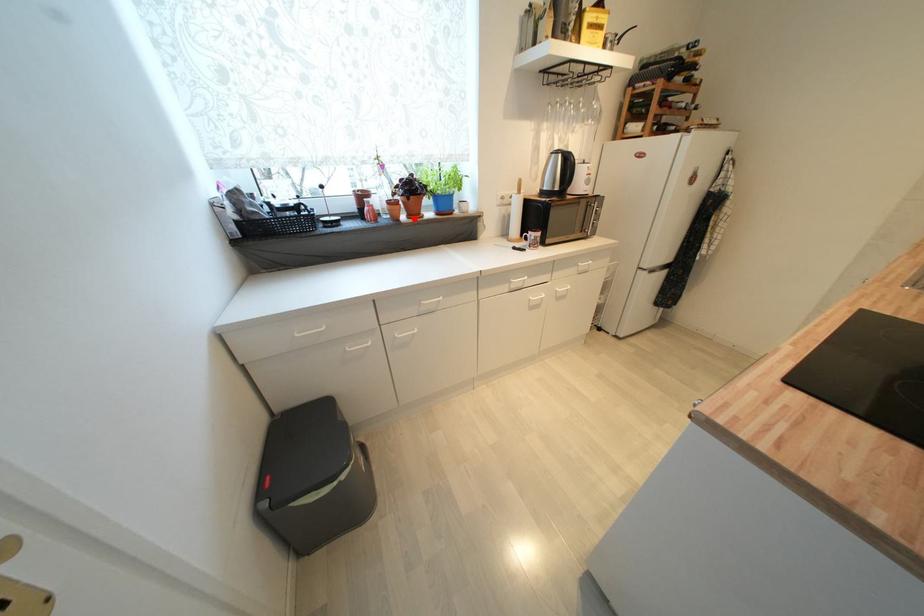
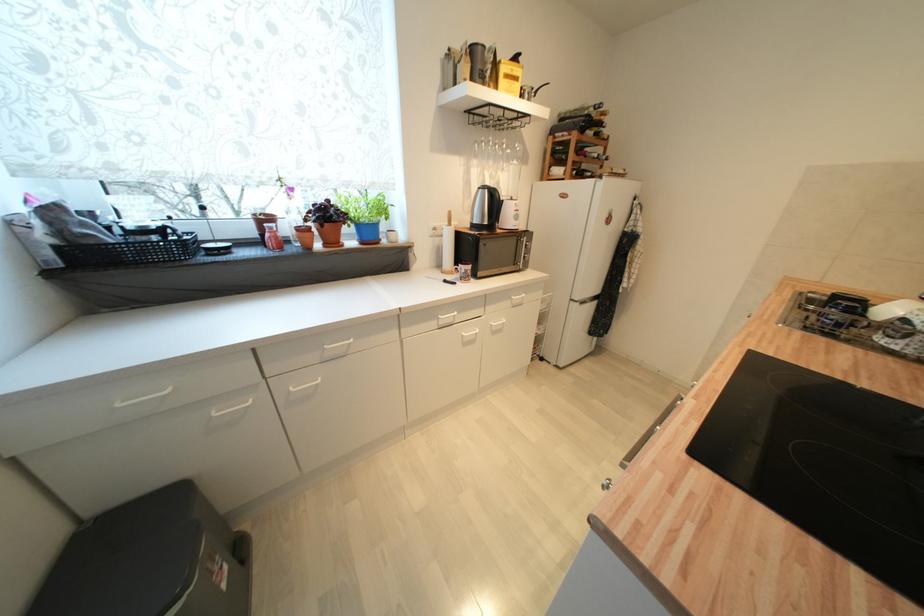
The point at the highlighted location is marked in the first image. Where is the corresponding point in the second image?

(331, 246)